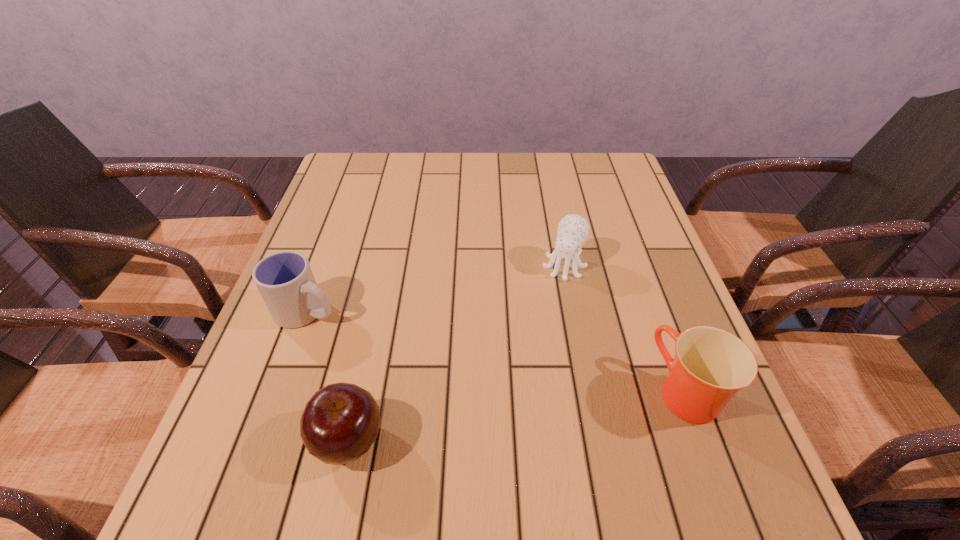
The height and width of the screenshot is (540, 960). In the image, there is a desktop. In order to click on vacant area at the far edge in this screenshot , I will do `click(460, 176)`.

Locate an element on the screen. vacant space at the left edge of the desktop is located at coordinates (321, 353).

Locate an element on the screen. vacant space at the right edge of the desktop is located at coordinates (597, 206).

Find the location of a particular element. vacant space at the far left corner is located at coordinates (327, 192).

The image size is (960, 540). What are the coordinates of `free location at the far right corner of the desktop` in the screenshot? It's located at [x=588, y=178].

The height and width of the screenshot is (540, 960). Find the location of `vacant region between the rightmost object and the third object from left to right`. vacant region between the rightmost object and the third object from left to right is located at coordinates (625, 329).

You are a GUI agent. You are given a task and a screenshot of the screen. Output one action in this format:
    pyautogui.click(x=<x>, y=<y>)
    Task: Click on the free space between the third object from left to right and the second farthest object
    This screenshot has width=960, height=540.
    Given the screenshot: What is the action you would take?
    pyautogui.click(x=436, y=288)

Image resolution: width=960 pixels, height=540 pixels. I want to click on free space between the octopus and the third nearest object, so click(x=436, y=288).

This screenshot has width=960, height=540. Find the location of `vacant space that is in between the third object from right to left and the farther cup`. vacant space that is in between the third object from right to left and the farther cup is located at coordinates (328, 375).

What are the coordinates of `free spot between the third object from right to left and the left cup` in the screenshot? It's located at 328,375.